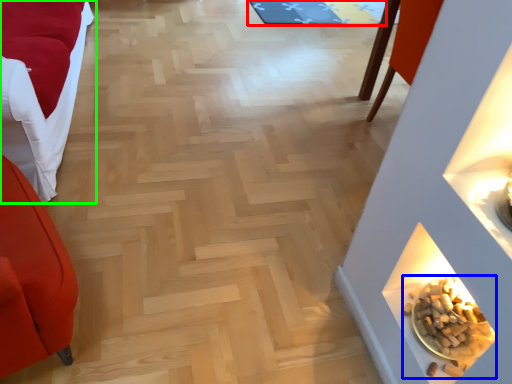
Question: Which object is positioned farthest from mat (highlighted by a red box)? Select from food (highlighted by a blue box) and furniture (highlighted by a green box).

Choices:
 (A) food
 (B) furniture

Answer: (A)